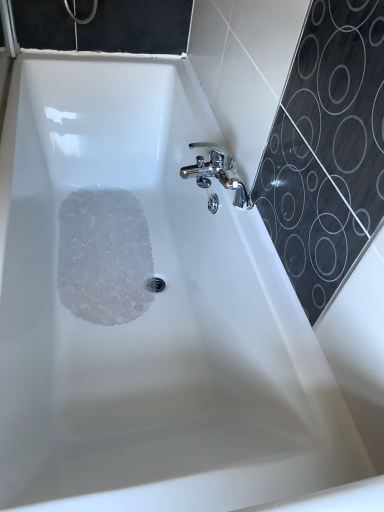
Image resolution: width=384 pixels, height=512 pixels. In order to click on blank space above translucent plastic beads at bottom (from a real-world perspective) in this screenshot , I will do `click(127, 248)`.